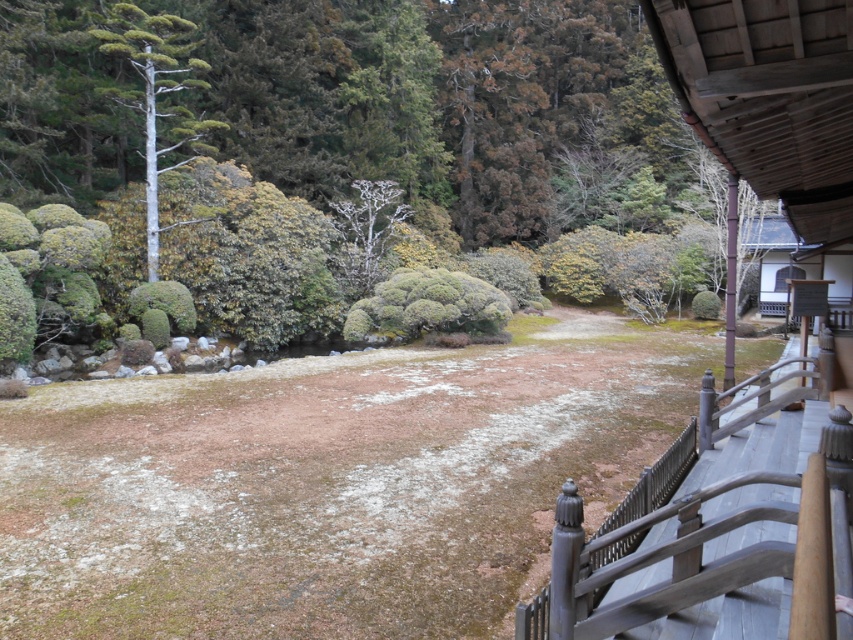
Question: Which point is farther to the camera?

Choices:
 (A) (488, 298)
 (B) (521, 614)

Answer: (A)

Question: Can you confirm if wooden railing at lower right is positioned to the left of bare white tree at center?

Choices:
 (A) yes
 (B) no

Answer: (B)

Question: Considering the real-world distances, which object is farthest from the white smooth tree at upper left?

Choices:
 (A) bare white tree at center
 (B) wooden railing at lower right

Answer: (B)

Question: Is wooden railing at lower right smaller than brown wooden hut at upper right?

Choices:
 (A) yes
 (B) no

Answer: (A)

Question: Among these objects, which one is farthest from the camera?

Choices:
 (A) white smooth tree at upper left
 (B) green textured bush at center

Answer: (B)

Question: Can you confirm if white smooth tree at upper left is positioned below green textured bush at center?

Choices:
 (A) yes
 (B) no

Answer: (B)